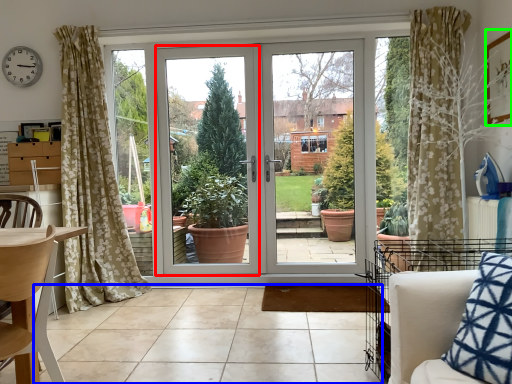
Question: Which object is the farthest from window frame (highlighted by a red box)? Choose among these: tile (highlighted by a blue box) or picture frame (highlighted by a green box).

Choices:
 (A) tile
 (B) picture frame

Answer: (B)